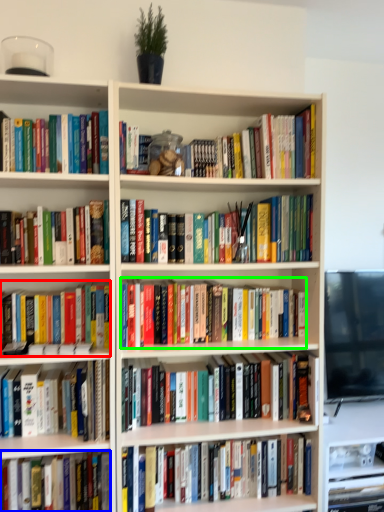
Question: Which object is the farthest from book (highlighted by a red box)? Choose among these: book (highlighted by a blue box) or book (highlighted by a green box).

Choices:
 (A) book
 (B) book

Answer: (A)